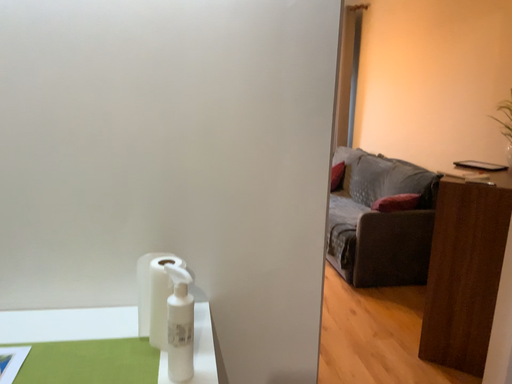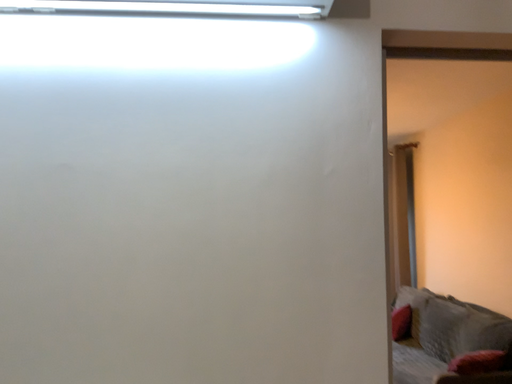
Question: How did the camera likely rotate when shooting the video?

Choices:
 (A) rotated downward
 (B) rotated upward

Answer: (B)